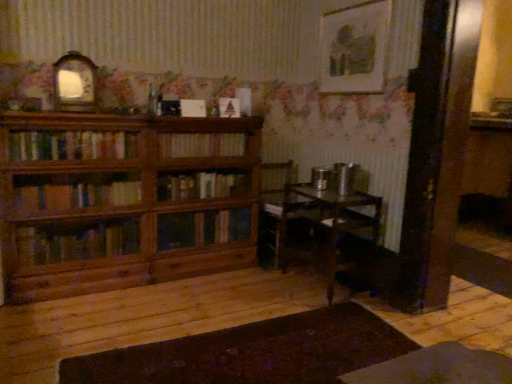
Find the location of `vacant space in front of wooden bookcase at left`. vacant space in front of wooden bookcase at left is located at coordinates (128, 327).